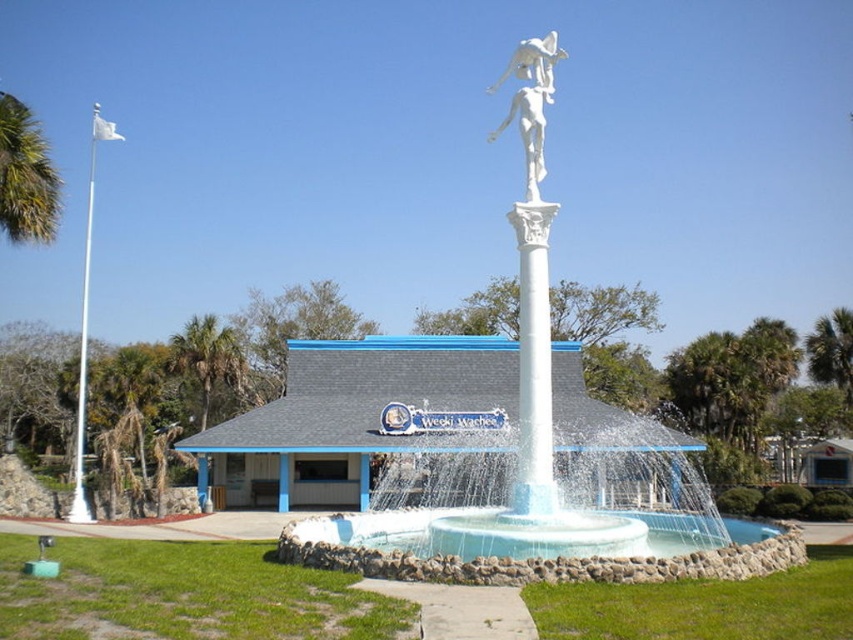
You are a landscape architect designing a new garden layout. You need to ensure that the white marble statue at center is visible from the entrance path, which is directly in front of the green leafy palm tree at upper right. Will the statue be visible from this vantage point considering their heights?

The white marble statue at center is taller than the green leafy palm tree at upper right, so it will be visible from the entrance path in front of the palm tree.

You are standing in the outdoor area and want to determine the relative positions of two points marked in the scene. Which of the two points, point (18, 209) or point (811, 349), is closer to you?

Point (18, 209) is closer to the viewer than point (811, 349).

You are standing at the center of the fountain and want to look towards the green leafy palm tree at left. Which direction should you turn to face the white metallic flagpole at left?

The green leafy palm tree at left is located below the white metallic flagpole at left, so if you are facing the palm tree at left, you should turn upwards to face the white metallic flagpole at left.